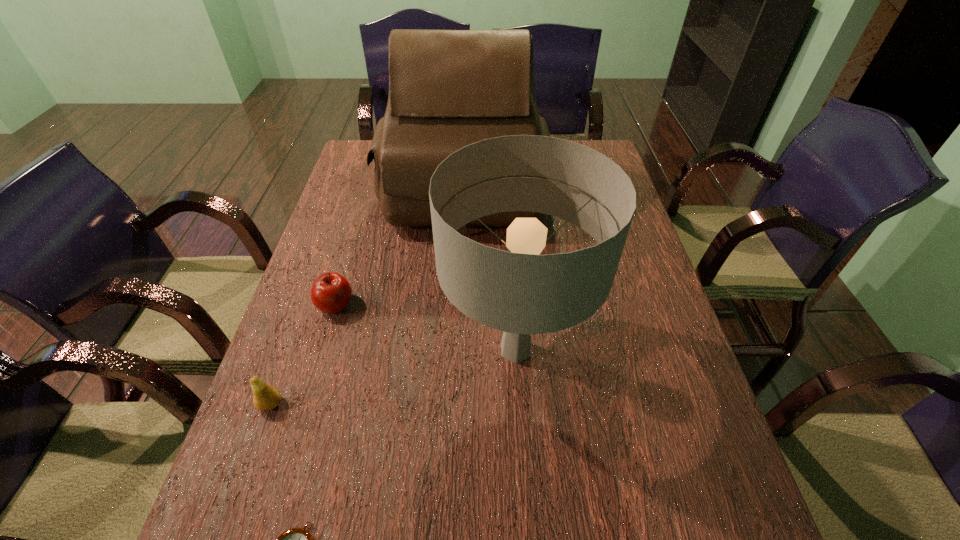
Locate an element on the screen. the farthest object is located at coordinates (448, 89).

The width and height of the screenshot is (960, 540). Find the location of `lampshade`. lampshade is located at coordinates (521, 293).

In order to click on apple in this screenshot , I will do `click(331, 292)`.

Where is `pear`? This screenshot has width=960, height=540. pear is located at coordinates (266, 397).

I want to click on vacant space located on the front flap of the farthest object, so click(459, 325).

The image size is (960, 540). What are the coordinates of `vacant space located on the front-facing side of the lampshade` in the screenshot? It's located at (523, 456).

Find the location of `free space located 0.060m on the back of the apple`. free space located 0.060m on the back of the apple is located at coordinates (345, 273).

Where is `free space located 0.160m on the back of the pear`? The image size is (960, 540). free space located 0.160m on the back of the pear is located at coordinates click(x=297, y=331).

Locate an element on the screen. The image size is (960, 540). object positioned at the far edge is located at coordinates (448, 89).

Identify the location of satchel that is at the left edge. (448, 89).